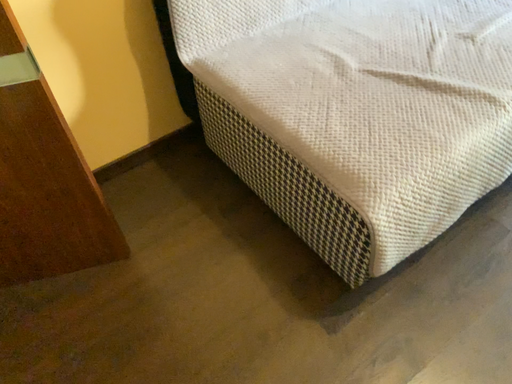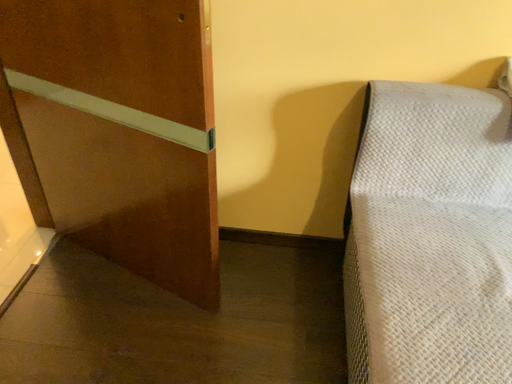
Question: How did the camera likely rotate when shooting the video?

Choices:
 (A) rotated right
 (B) rotated left

Answer: (B)